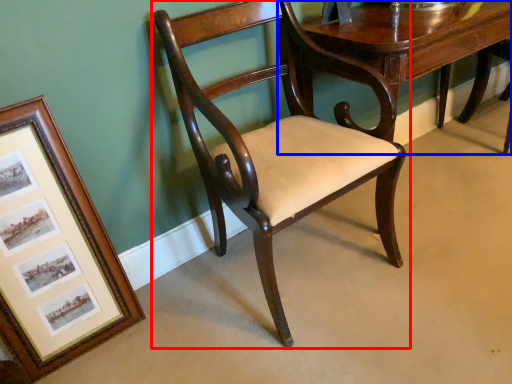
Question: Which object is closer to the camera taking this photo, chair (highlighted by a red box) or table (highlighted by a blue box)?

Choices:
 (A) chair
 (B) table

Answer: (A)